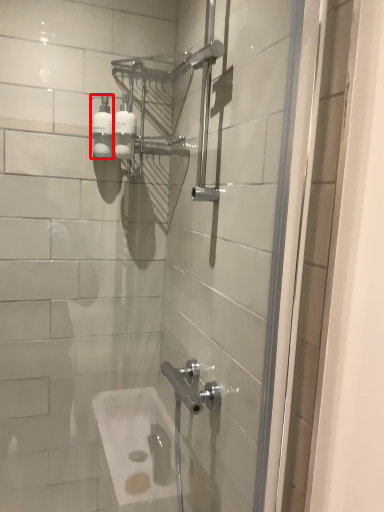
Question: In this image, where is toiletry (annotated by the red box) located relative to toiletry?

Choices:
 (A) left
 (B) right

Answer: (A)